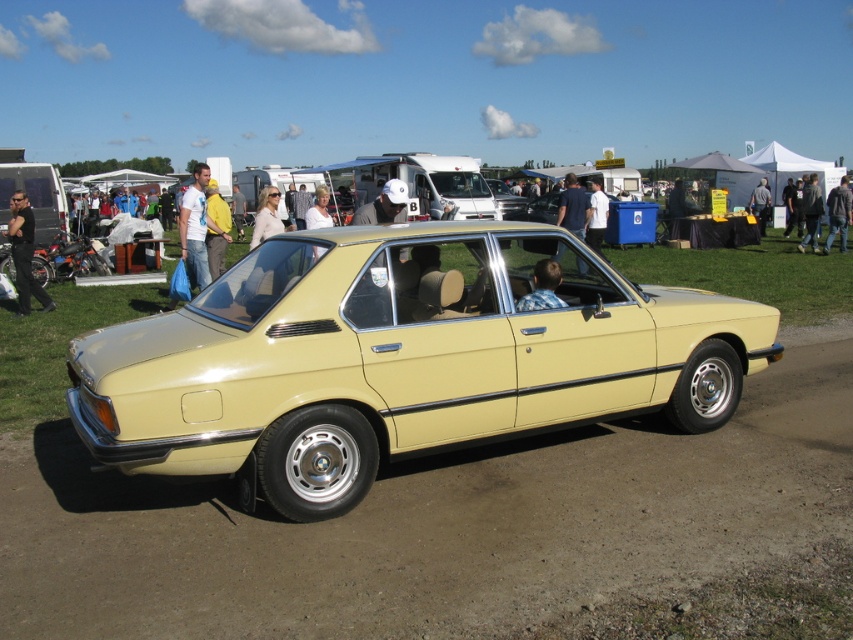
Describe the element at coordinates (573, 205) in the screenshot. Image resolution: width=853 pixels, height=640 pixels. I see `blue denim shirt at center` at that location.

Does point (569, 228) come closer to viewer compared to point (830, 243)?

That is True.

Does point (566, 218) come closer to viewer compared to point (838, 186)?

Yes, it is in front of point (838, 186).

The width and height of the screenshot is (853, 640). Find the location of `blue denim shirt at center`. blue denim shirt at center is located at coordinates (573, 205).

Is point (114, 460) behind point (808, 230)?

No, (114, 460) is closer to viewer.

The height and width of the screenshot is (640, 853). What do you see at coordinates (398, 358) in the screenshot?
I see `matte yellow car at center` at bounding box center [398, 358].

This screenshot has width=853, height=640. Describe the element at coordinates (398, 358) in the screenshot. I see `matte yellow car at center` at that location.

You are a GUI agent. You are given a task and a screenshot of the screen. Output one action in this format:
    pyautogui.click(x=<x>, y=<y>)
    Task: Click on the matte yellow car at center
    The image size is (853, 640).
    Given the screenshot: What is the action you would take?
    pyautogui.click(x=398, y=358)

Which is in front, point (554, 257) or point (518, 310)?

Point (518, 310)

Is point (584, 220) positioned behind point (547, 268)?

Yes.

Does point (561, 209) come closer to viewer compared to point (567, 305)?

No, it is behind (567, 305).

The width and height of the screenshot is (853, 640). What are the coordinates of `blue denim shirt at center` in the screenshot? It's located at (573, 205).